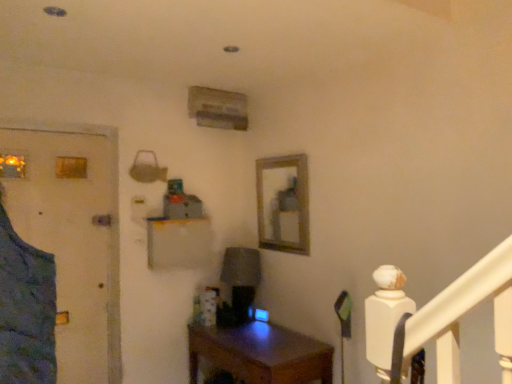
Question: Can wooden desk at center be found inside blue fabric door at left?

Choices:
 (A) no
 (B) yes

Answer: (A)

Question: Does blue fabric door at left have a greater height compared to wooden desk at center?

Choices:
 (A) no
 (B) yes

Answer: (B)

Question: Is the position of blue fabric door at left more distant than that of wooden desk at center?

Choices:
 (A) yes
 (B) no

Answer: (A)

Question: From a real-world perspective, is blue fabric door at left beneath wooden desk at center?

Choices:
 (A) no
 (B) yes

Answer: (A)

Question: Does blue fabric door at left turn towards wooden desk at center?

Choices:
 (A) no
 (B) yes

Answer: (A)

Question: From a real-world perspective, is wooden desk at center positioned above or below blue fabric door at left?

Choices:
 (A) above
 (B) below

Answer: (B)

Question: Is wooden desk at center spatially inside blue fabric door at left, or outside of it?

Choices:
 (A) outside
 (B) inside

Answer: (A)

Question: From the image's perspective, is wooden desk at center located above or below blue fabric door at left?

Choices:
 (A) above
 (B) below

Answer: (B)

Question: From their relative heights in the image, would you say wooden desk at center is taller or shorter than blue fabric door at left?

Choices:
 (A) short
 (B) tall

Answer: (A)

Question: From a real-world perspective, is wooden frame at center positioned above or below wooden desk at center?

Choices:
 (A) below
 (B) above

Answer: (B)

Question: From the image's perspective, is wooden frame at center located above or below wooden desk at center?

Choices:
 (A) below
 (B) above

Answer: (B)

Question: Considering their positions, is wooden frame at center located in front of or behind wooden desk at center?

Choices:
 (A) behind
 (B) front

Answer: (A)

Question: Do you think wooden frame at center is within wooden desk at center, or outside of it?

Choices:
 (A) outside
 (B) inside

Answer: (A)

Question: From the image's perspective, is wooden frame at center above or below blue fabric door at left?

Choices:
 (A) above
 (B) below

Answer: (A)

Question: Is wooden frame at center taller or shorter than blue fabric door at left?

Choices:
 (A) tall
 (B) short

Answer: (B)